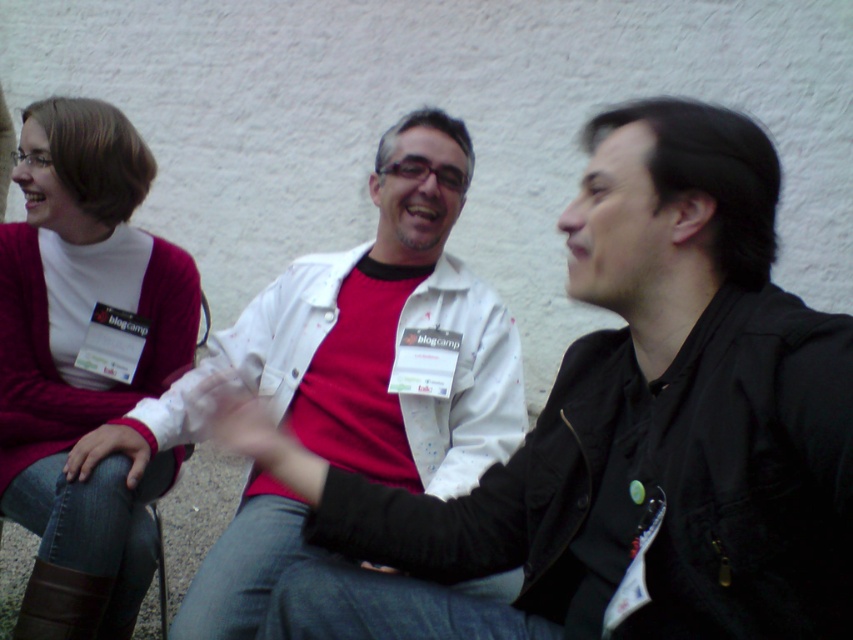
Question: Which object is farther from the camera taking this photo?

Choices:
 (A) white matte jacket at center
 (B) matte white jacket at center

Answer: (A)

Question: Is white matte jacket at center above matte pink sweater at left?

Choices:
 (A) yes
 (B) no

Answer: (A)

Question: Among these points, which one is nearest to the camera?

Choices:
 (A) (165, 403)
 (B) (709, 228)
 (C) (56, 241)

Answer: (B)

Question: Is the position of matte white jacket at center more distant than that of white matte jacket at center?

Choices:
 (A) yes
 (B) no

Answer: (B)

Question: From the image, what is the correct spatial relationship of white matte jacket at center in relation to matte pink sweater at left?

Choices:
 (A) left
 (B) right

Answer: (B)

Question: Which of the following is the farthest from the observer?

Choices:
 (A) matte white jacket at center
 (B) white matte jacket at center

Answer: (B)